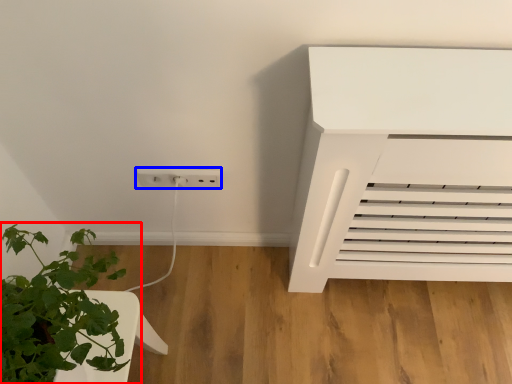
Question: Which object appears farthest to the camera in this image, houseplant (highlighted by a red box) or electric outlet (highlighted by a blue box)?

Choices:
 (A) houseplant
 (B) electric outlet

Answer: (B)